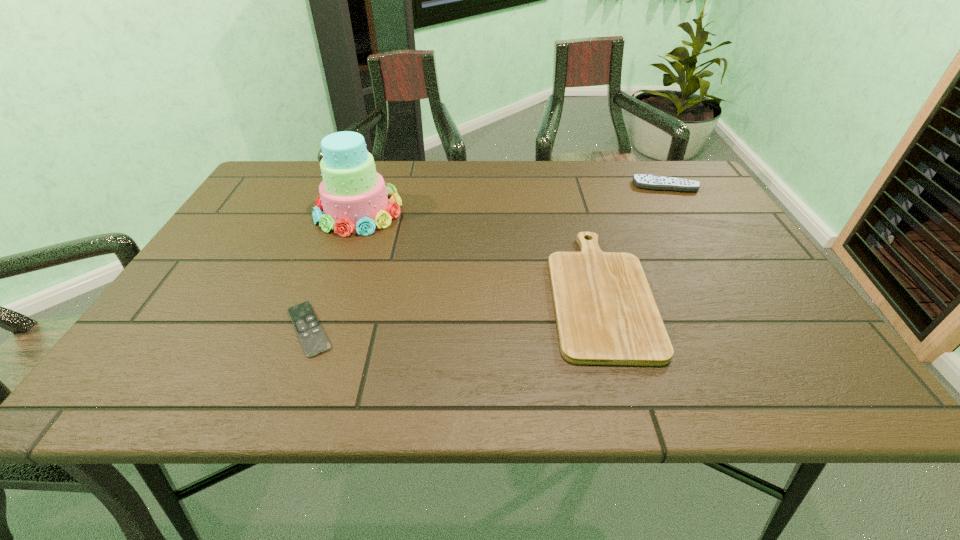
At what (x,y) coordinates should I click in order to perform the action: click on the tallest object. Please return your answer as a coordinate pair (x, y). Image resolution: width=960 pixels, height=540 pixels. Looking at the image, I should click on (353, 195).

In order to click on the taller remote control in this screenshot , I will do `click(644, 181)`.

The height and width of the screenshot is (540, 960). In order to click on the rightmost object in this screenshot , I will do `click(644, 181)`.

You are a GUI agent. You are given a task and a screenshot of the screen. Output one action in this format:
    pyautogui.click(x=<x>, y=<y>)
    Task: Click on the chopping board
    This screenshot has width=960, height=540.
    Given the screenshot: What is the action you would take?
    pyautogui.click(x=606, y=314)

This screenshot has width=960, height=540. I want to click on the second object from right to left, so click(x=606, y=314).

Locate an element on the screen. The width and height of the screenshot is (960, 540). the nearer remote control is located at coordinates tap(314, 341).

Where is `the shortest object`? This screenshot has height=540, width=960. the shortest object is located at coordinates (314, 341).

Find the location of `vacant region located 0.240m on the right of the tallest object`. vacant region located 0.240m on the right of the tallest object is located at coordinates (491, 211).

I want to click on vacant space located on the left of the farther remote control, so click(500, 186).

You are a GUI agent. You are given a task and a screenshot of the screen. Output one action in this format:
    pyautogui.click(x=<x>, y=<y>)
    Task: Click on the blank space located 0.210m on the left of the third object from left to right
    The width and height of the screenshot is (960, 540).
    Given the screenshot: What is the action you would take?
    pyautogui.click(x=454, y=292)